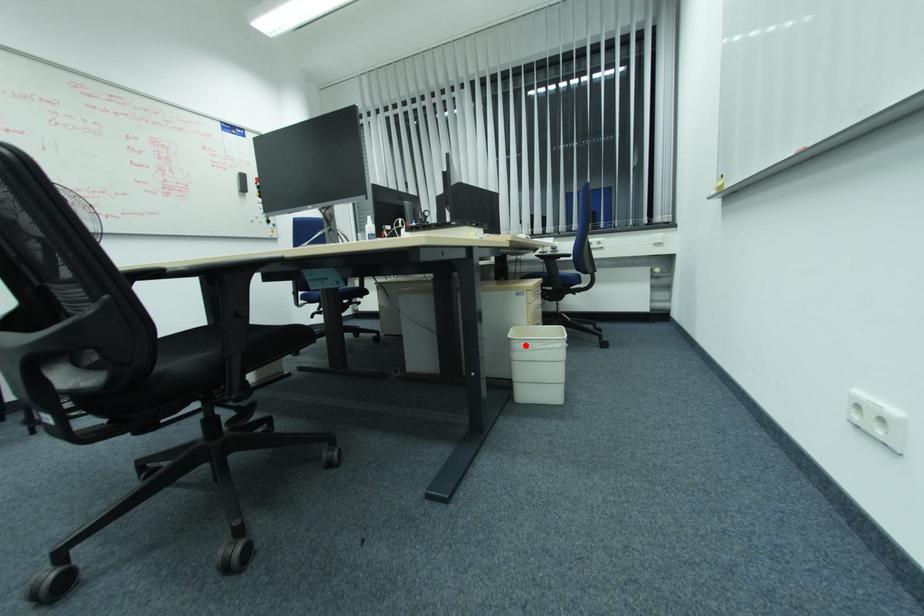
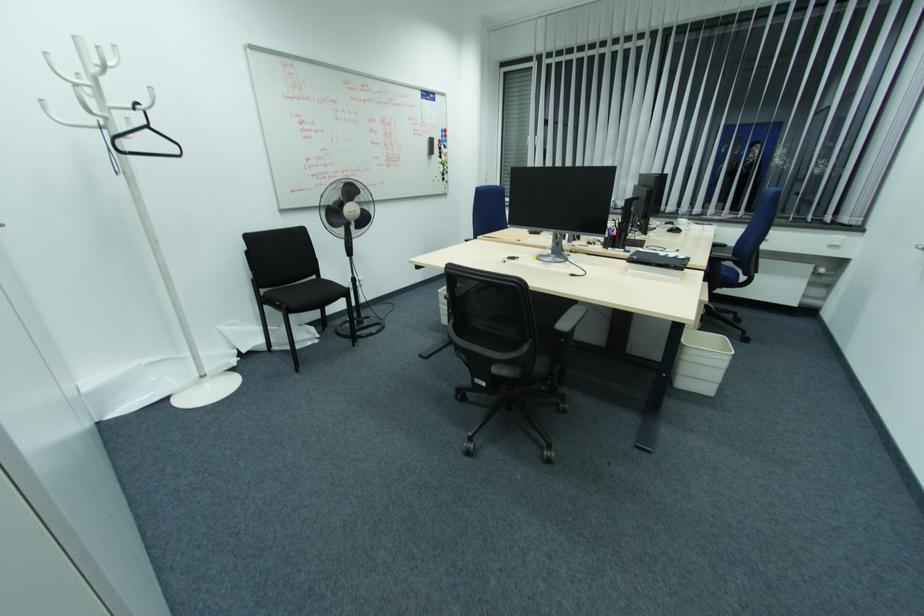
In the second image, find the point that corresponds to the highlighted location in the first image.

(698, 353)